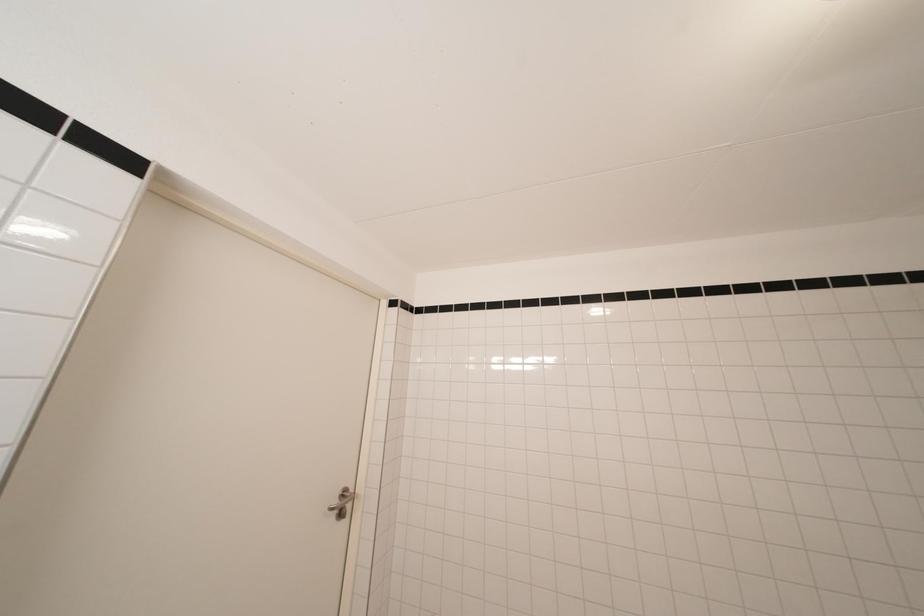
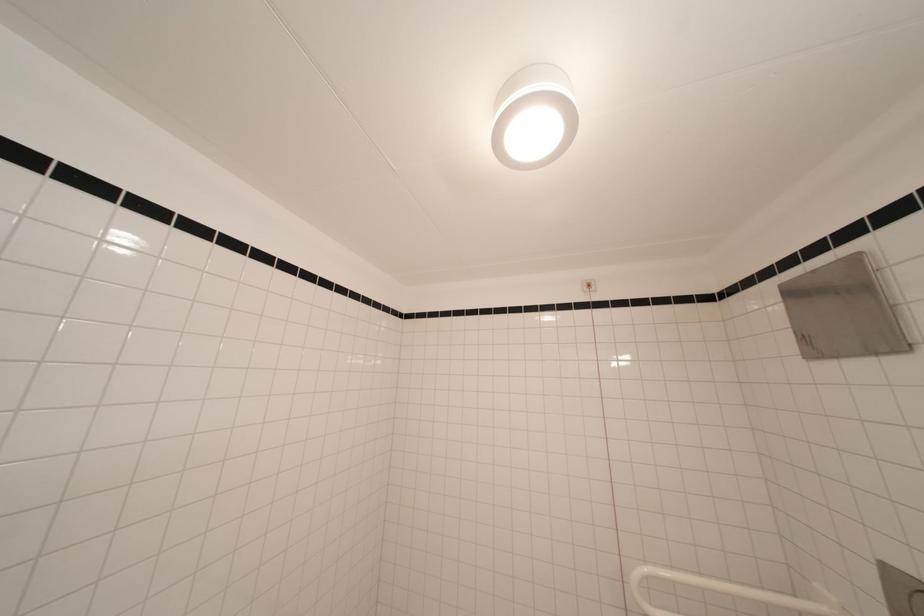
Question: The first image is from the beginning of the video and the second image is from the end. How did the camera likely rotate when shooting the video?

Choices:
 (A) Left
 (B) Right
 (C) Up
 (D) Down

Answer: (B)